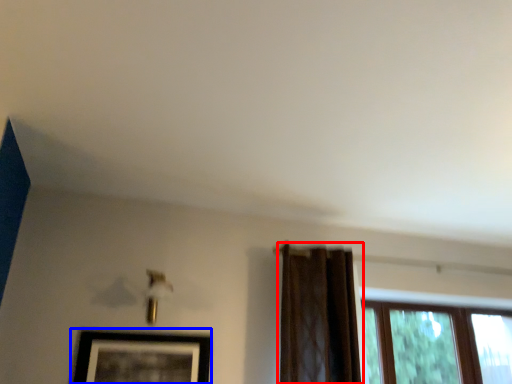
Question: Which object is closer to the camera taking this photo, curtain (highlighted by a red box) or picture frame (highlighted by a blue box)?

Choices:
 (A) curtain
 (B) picture frame

Answer: (B)